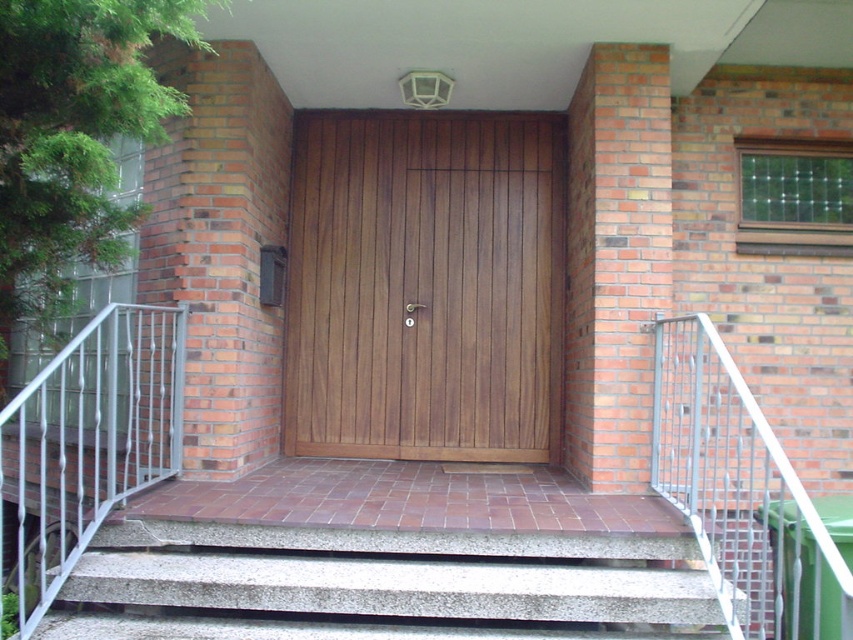
Which of these two, gray concrete stairs at lower left or metallic silver railing at right, stands shorter?

gray concrete stairs at lower left

How much distance is there between gray concrete stairs at lower left and metallic silver railing at right?

The distance of gray concrete stairs at lower left from metallic silver railing at right is 39.36 inches.

Is point (634, 611) more distant than point (698, 362)?

No, (634, 611) is closer to viewer.

Identify the location of gray concrete stairs at lower left. (380, 586).

Which is more to the right, gray concrete stairs at lower left or white metal balustrade at left?

gray concrete stairs at lower left

Between point (519, 600) and point (105, 502), which one is positioned in front?

Point (519, 600) is more forward.

I want to click on gray concrete stairs at lower left, so click(380, 586).

Which is more to the right, wooden door at center or gray concrete stairs at lower left?

Positioned to the right is wooden door at center.

Which is below, wooden door at center or gray concrete stairs at lower left?

gray concrete stairs at lower left

Does point (521, 408) come closer to viewer compared to point (456, 621)?

No, (521, 408) is further to viewer.

Where is `wooden door at center`? The height and width of the screenshot is (640, 853). wooden door at center is located at coordinates (424, 285).